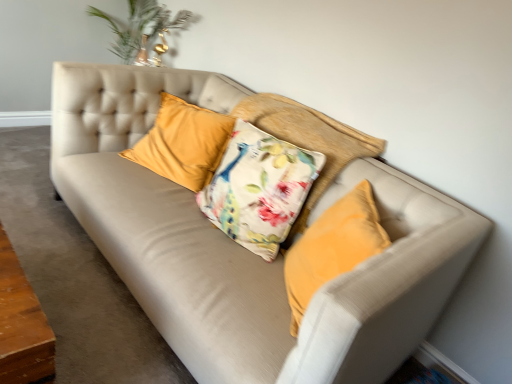
Question: Which is correct: velvet yellow pillow at center, marked as the 2th pillow in a right-to-left arrangement, is inside suede beige couch at center, or outside of it?

Choices:
 (A) inside
 (B) outside

Answer: (B)

Question: Considering the positions of velvet yellow pillow at center, the first pillow positioned from the left, and suede beige couch at center in the image, is velvet yellow pillow at center, the first pillow positioned from the left, bigger or smaller than suede beige couch at center?

Choices:
 (A) big
 (B) small

Answer: (B)

Question: Considering the real-world distances, which object is closest to the suede beige couch at center?

Choices:
 (A) floral fabric cushion at center, the 1th pillow from the right
 (B) velvet yellow pillow at center, marked as the 2th pillow in a right-to-left arrangement

Answer: (B)

Question: Which object is positioned farthest from the velvet yellow pillow at center, the first pillow positioned from the left?

Choices:
 (A) suede beige couch at center
 (B) floral fabric cushion at center, the 2th pillow in the left-to-right sequence

Answer: (A)